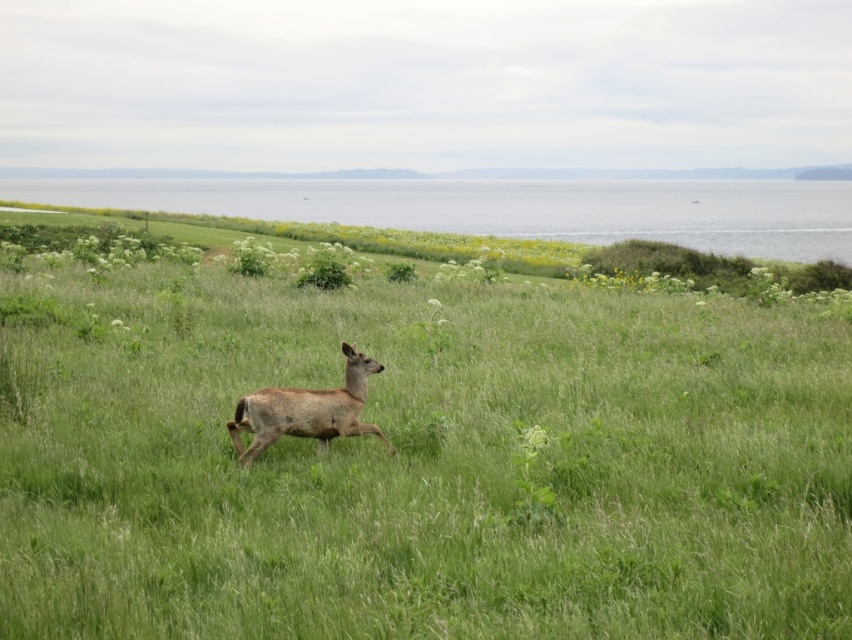
Which is below, green grassy field at center or gray water at upper center?

green grassy field at center is below.

Who is positioned more to the right, green grassy field at center or gray water at upper center?

green grassy field at center is more to the right.

Describe the element at coordinates (419, 461) in the screenshot. I see `green grassy field at center` at that location.

Identify the location of green grassy field at center. The height and width of the screenshot is (640, 852). (419, 461).

Can you confirm if green grassy field at center is positioned above brown fur deer at center?

Indeed, green grassy field at center is positioned over brown fur deer at center.

Which is above, green grassy field at center or brown fur deer at center?

Positioned higher is green grassy field at center.

Where is `green grassy field at center`? green grassy field at center is located at coordinates (419, 461).

Is gray water at upper center to the left of brown fur deer at center from the viewer's perspective?

Correct, you'll find gray water at upper center to the left of brown fur deer at center.

Between point (228, 212) and point (278, 435), which one is positioned in front?

Positioned in front is point (278, 435).

Which is in front, point (453, 196) or point (272, 410)?

Point (272, 410) is in front.

You are a GUI agent. You are given a task and a screenshot of the screen. Output one action in this format:
    pyautogui.click(x=<x>, y=<y>)
    Task: Click on the gray water at upper center
    
    Given the screenshot: What is the action you would take?
    pyautogui.click(x=509, y=208)